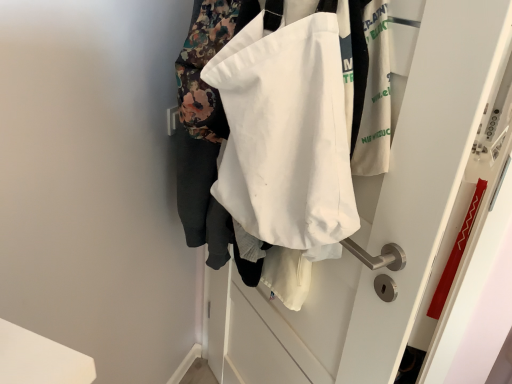
Question: Should I look upward or downward to see white fabric bag at center?

Choices:
 (A) down
 (B) up

Answer: (A)